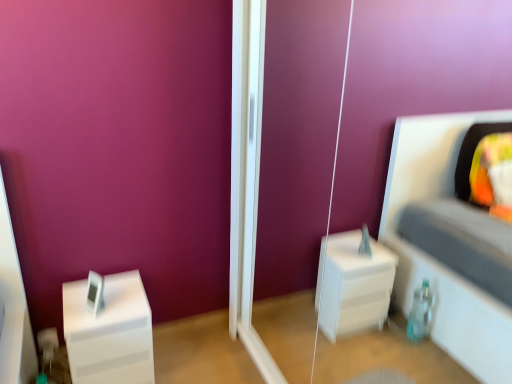
Image resolution: width=512 pixels, height=384 pixels. I want to click on transparent glass door at center, so click(x=247, y=177).

Describe the element at coordinates (247, 177) in the screenshot. I see `transparent glass door at center` at that location.

The height and width of the screenshot is (384, 512). What are the coordinates of `white glossy nightstand at left` in the screenshot? It's located at (109, 332).

The height and width of the screenshot is (384, 512). What do you see at coordinates (109, 332) in the screenshot?
I see `white glossy nightstand at left` at bounding box center [109, 332].

The height and width of the screenshot is (384, 512). In order to click on transparent glass door at center in this screenshot , I will do `click(247, 177)`.

Is transparent glass door at center at the left side of white glossy nightstand at left?

No.

Considering the relative positions of transparent glass door at center and white glossy nightstand at left in the image provided, is transparent glass door at center behind white glossy nightstand at left?

No, transparent glass door at center is closer to the camera.

Between point (247, 38) and point (106, 351), which one is positioned in front?

Positioned in front is point (106, 351).

From the image's perspective, is transparent glass door at center on top of white glossy nightstand at left?

Indeed, from the image's perspective, transparent glass door at center is shown above white glossy nightstand at left.

Looking at this image, from a real-world perspective, which is physically below, transparent glass door at center or white glossy nightstand at left?

white glossy nightstand at left is physically lower.

Considering the sizes of objects transparent glass door at center and white glossy nightstand at left in the image provided, who is thinner, transparent glass door at center or white glossy nightstand at left?

Thinner between the two is transparent glass door at center.

Considering the sizes of objects transparent glass door at center and white glossy nightstand at left in the image provided, who is shorter, transparent glass door at center or white glossy nightstand at left?

white glossy nightstand at left is shorter.

From the picture: Based on their sizes in the image, would you say transparent glass door at center is bigger or smaller than white glossy nightstand at left?

Considering their sizes, transparent glass door at center takes up more space than white glossy nightstand at left.

Would you say transparent glass door at center contains white glossy nightstand at left?

No, white glossy nightstand at left is not inside transparent glass door at center.

Is transparent glass door at center beside white glossy nightstand at left?

No, transparent glass door at center is not making contact with white glossy nightstand at left.

Is transparent glass door at center oriented away from white glossy nightstand at left?

transparent glass door at center is not turned away from white glossy nightstand at left.

Can you tell me how much transparent glass door at center and white glossy nightstand at left differ in facing direction?

The facing directions of transparent glass door at center and white glossy nightstand at left are 90.1 degrees apart.

The height and width of the screenshot is (384, 512). I want to click on furniture beneath the transparent glass door at center (from a real-world perspective), so click(109, 332).

Looking at this image, considering the positions of objects white glossy nightstand at left and transparent glass door at center in the image provided, who is more to the right, white glossy nightstand at left or transparent glass door at center?

Positioned to the right is transparent glass door at center.

Is white glossy nightstand at left in front of or behind transparent glass door at center in the image?

white glossy nightstand at left is positioned farther from the viewer than transparent glass door at center.

Is point (71, 360) farther from viewer compared to point (262, 67)?

No, it is in front of (262, 67).

From the image's perspective, is white glossy nightstand at left under transparent glass door at center?

Correct, white glossy nightstand at left appears lower than transparent glass door at center in the image.

From a real-world perspective, is white glossy nightstand at left physically below transparent glass door at center?

Indeed, from a real-world perspective, white glossy nightstand at left is positioned beneath transparent glass door at center.

Between white glossy nightstand at left and transparent glass door at center, which one has smaller width?

transparent glass door at center.

From their relative heights in the image, would you say white glossy nightstand at left is taller or shorter than transparent glass door at center?

In the image, white glossy nightstand at left appears to be shorter than transparent glass door at center.

Which of these two, white glossy nightstand at left or transparent glass door at center, is bigger?

transparent glass door at center is bigger.

Do you think white glossy nightstand at left is within transparent glass door at center, or outside of it?

white glossy nightstand at left is located beyond the bounds of transparent glass door at center.

Is white glossy nightstand at left not near transparent glass door at center?

No, white glossy nightstand at left is not far away from transparent glass door at center.

Could you tell me if white glossy nightstand at left is facing transparent glass door at center?

No, white glossy nightstand at left is not aimed at transparent glass door at center.

Can you tell me how much white glossy nightstand at left and transparent glass door at center differ in facing direction?

They differ by 90.1 degrees in their facing directions.

This screenshot has width=512, height=384. In order to click on furniture on the left of transparent glass door at center in this screenshot , I will do `click(109, 332)`.

Where is `furniture below the transparent glass door at center (from a real-world perspective)`? The height and width of the screenshot is (384, 512). furniture below the transparent glass door at center (from a real-world perspective) is located at coordinates 109,332.

Find the location of a particular element. The image size is (512, 384). glass door above the white glossy nightstand at left (from the image's perspective) is located at coordinates (247, 177).